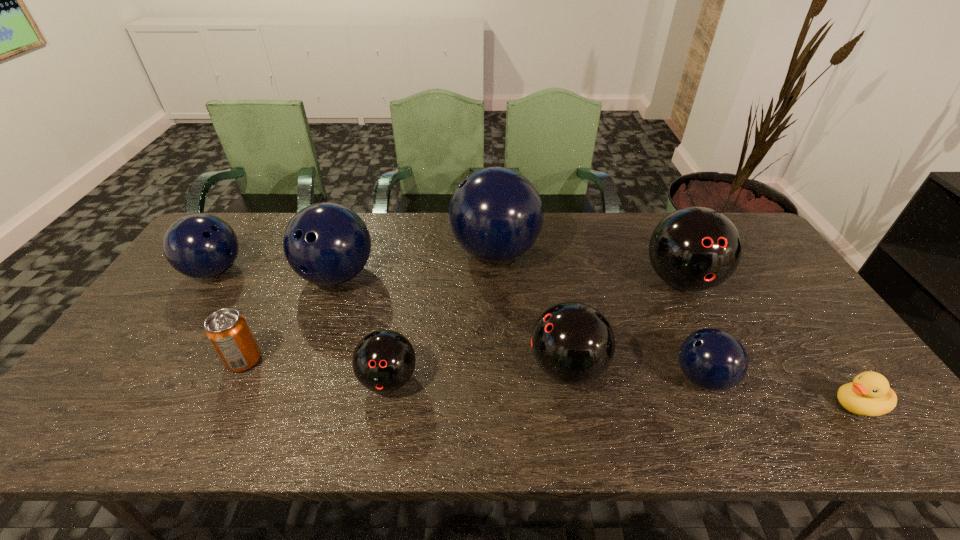
Locate an element on the screen. the biggest blue bowling ball is located at coordinates (495, 214).

The height and width of the screenshot is (540, 960). I want to click on the third blue bowling ball from left to right, so click(495, 214).

You are a GUI agent. You are given a task and a screenshot of the screen. Output one action in this format:
    pyautogui.click(x=<x>, y=<y>)
    Task: Click on the farthest black bowling ball
    
    Given the screenshot: What is the action you would take?
    pyautogui.click(x=694, y=249)

Locate an element on the screen. the rightmost black bowling ball is located at coordinates (694, 249).

Find the location of a particular element. the second bowling ball from left to right is located at coordinates (326, 243).

Find the location of a particular element. This screenshot has height=540, width=960. the second blue bowling ball from left to right is located at coordinates (326, 243).

Find the location of a particular element. the third biggest blue bowling ball is located at coordinates (201, 246).

Locate an element on the screen. the leftmost bowling ball is located at coordinates (201, 246).

Locate an element on the screen. The image size is (960, 540). the second black bowling ball from left to right is located at coordinates (573, 343).

This screenshot has width=960, height=540. I want to click on soda can, so click(x=228, y=332).